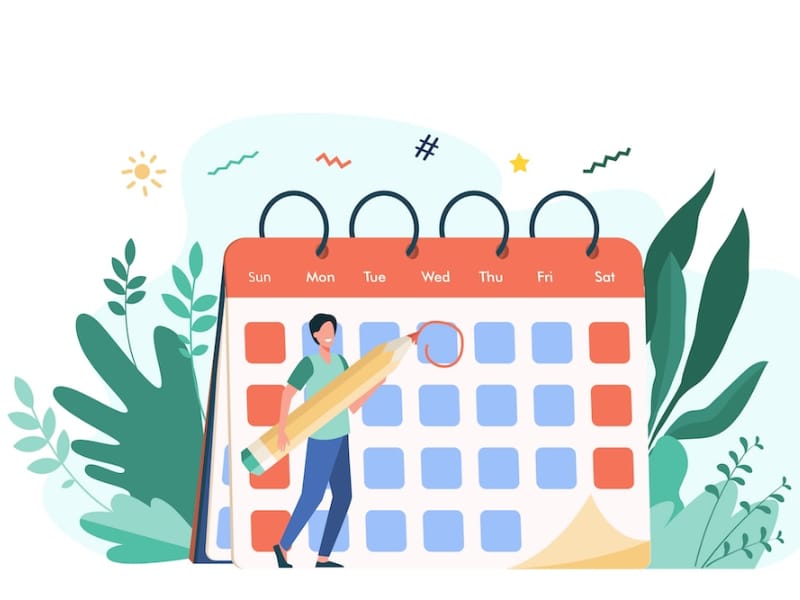
Where is `red squares on calendar`? This screenshot has width=800, height=600. red squares on calendar is located at coordinates (618, 338), (618, 395), (618, 472), (258, 334), (258, 399), (268, 475), (268, 530).